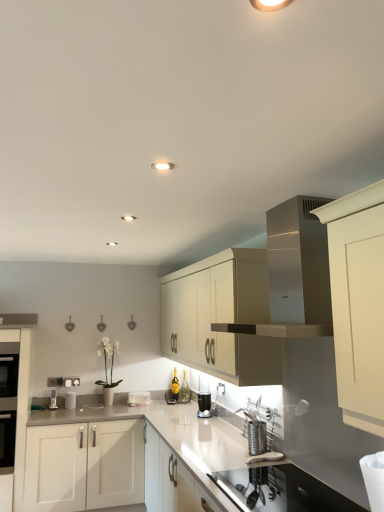
The width and height of the screenshot is (384, 512). In order to click on matte cream cabinet at center, the first cabinetry from the right in this screenshot , I will do `click(220, 317)`.

Locate an element on the screen. Image resolution: width=384 pixels, height=512 pixels. clear glass cup at center, the 3th appliance in the back-to-front sequence is located at coordinates tap(204, 399).

The image size is (384, 512). I want to click on black glass oven at left, so click(x=8, y=403).

Where is `white glossy toaster at center, which is the 2th appliance in left-to-right order`? The width and height of the screenshot is (384, 512). white glossy toaster at center, which is the 2th appliance in left-to-right order is located at coordinates (70, 400).

Is white glossy countertop at center outside of white glossy cabinet at left, arranged as the 1th cabinetry when viewed from the left?

Yes, white glossy countertop at center is located beyond the bounds of white glossy cabinet at left, arranged as the 1th cabinetry when viewed from the left.

Identify the location of countertop on the right side of white glossy cabinet at left, arranged as the 2th cabinetry when viewed from the right. (169, 432).

Is white glossy cabinet at left, arranged as the 1th cabinetry when viewed from the left, at the back of white glossy countertop at center?

No, white glossy countertop at center's orientation is not away from white glossy cabinet at left, arranged as the 1th cabinetry when viewed from the left.

From a real-world perspective, relative to satin silver vent at upper center, is black glass oven at left vertically above or below?

From a real-world perspective, black glass oven at left is physically below satin silver vent at upper center.

Is black glass oven at left oriented towards satin silver vent at upper center?

No, black glass oven at left does not turn towards satin silver vent at upper center.

From the image's perspective, would you say black glass oven at left is shown under satin silver vent at upper center?

Yes, from the image's perspective, black glass oven at left is below satin silver vent at upper center.

Is black glass oven at left placed right next to satin silver vent at upper center?

black glass oven at left and satin silver vent at upper center are not in contact.

Which object is positioned more to the right, white glossy cabinet at left, arranged as the 2th cabinetry when viewed from the right, or white glossy toaster at lower left, acting as the second appliance starting from the back?

white glossy toaster at lower left, acting as the second appliance starting from the back, is more to the right.

Does white glossy cabinet at left, arranged as the 1th cabinetry when viewed from the left, have a lesser height compared to white glossy toaster at lower left, which is the 3th appliance in right-to-left order?

Incorrect, the height of white glossy cabinet at left, arranged as the 1th cabinetry when viewed from the left, does not fall short of that of white glossy toaster at lower left, which is the 3th appliance in right-to-left order.

Locate an element on the screen. The width and height of the screenshot is (384, 512). the 2nd appliance above the white glossy cabinet at left, arranged as the 1th cabinetry when viewed from the left (from a real-world perspective) is located at coordinates (53, 400).

Based on the photo, is white glossy toaster at lower left, which is the 3th appliance in right-to-left order, located within white glossy cabinet at left, arranged as the 2th cabinetry when viewed from the right?

No, white glossy toaster at lower left, which is the 3th appliance in right-to-left order, is located outside of white glossy cabinet at left, arranged as the 2th cabinetry when viewed from the right.

From the image's perspective, is white glossy toaster at center, the 3th appliance viewed from the front, on top of white glossy countertop at center?

Yes, from the image's perspective, white glossy toaster at center, the 3th appliance viewed from the front, is above white glossy countertop at center.

Is white glossy toaster at center, the second appliance in the right-to-left sequence, wider or thinner than white glossy countertop at center?

Considering their sizes, white glossy toaster at center, the second appliance in the right-to-left sequence, looks slimmer than white glossy countertop at center.

Identify the location of countertop below the white glossy toaster at center, the second appliance in the right-to-left sequence (from the image's perspective). The height and width of the screenshot is (512, 384). (169, 432).

Considering the sizes of objects white glossy toaster at center, the second appliance in the right-to-left sequence, and white glossy countertop at center in the image provided, who is bigger, white glossy toaster at center, the second appliance in the right-to-left sequence, or white glossy countertop at center?

Bigger between the two is white glossy countertop at center.

How different are the orientations of clear glass cup at center, acting as the 3th appliance starting from the left, and satin silver vent at upper center in degrees?

They differ by 1.92 degrees in their facing directions.

Which is more to the left, clear glass cup at center, which is the first appliance in front-to-back order, or satin silver vent at upper center?

clear glass cup at center, which is the first appliance in front-to-back order, is more to the left.

Which of these two, clear glass cup at center, which is the first appliance in front-to-back order, or satin silver vent at upper center, stands taller?

With more height is satin silver vent at upper center.

Is clear glass cup at center, the 3th appliance in the back-to-front sequence, aimed at satin silver vent at upper center?

No.

In the image, is satin silver vent at upper center positioned in front of or behind matte cream cabinet at center, the first cabinetry from the right?

satin silver vent at upper center is positioned closer to the viewer than matte cream cabinet at center, the first cabinetry from the right.

Between satin silver vent at upper center and matte cream cabinet at center, the first cabinetry from the right, which one has smaller width?

Thinner between the two is matte cream cabinet at center, the first cabinetry from the right.

From the image's perspective, between satin silver vent at upper center and matte cream cabinet at center, the second cabinetry from the left, which one is located above?

satin silver vent at upper center is shown above in the image.

Is clear glass cup at center, which is the first appliance in front-to-back order, in front of or behind white glossy toaster at lower left, acting as the second appliance starting from the back, in the image?

Visually, clear glass cup at center, which is the first appliance in front-to-back order, is located in front of white glossy toaster at lower left, acting as the second appliance starting from the back.

In terms of size, does clear glass cup at center, acting as the 3th appliance starting from the left, appear bigger or smaller than white glossy toaster at lower left, the 1th appliance positioned from the left?

clear glass cup at center, acting as the 3th appliance starting from the left, is bigger than white glossy toaster at lower left, the 1th appliance positioned from the left.

Is clear glass cup at center, acting as the 3th appliance starting from the left, with white glossy toaster at lower left, acting as the second appliance starting from the back?

clear glass cup at center, acting as the 3th appliance starting from the left, and white glossy toaster at lower left, acting as the second appliance starting from the back, are not in contact.

You are a GUI agent. You are given a task and a screenshot of the screen. Output one action in this format:
    pyautogui.click(x=<x>, y=<y>)
    Task: Click on the appliance in front of the white glossy toaster at lower left, positioned as the 2th appliance in front-to-back order
    This screenshot has height=512, width=384.
    Given the screenshot: What is the action you would take?
    pyautogui.click(x=204, y=399)

This screenshot has width=384, height=512. In order to click on the 1st cabinetry above when counting from the white glossy countertop at center (from the image's perspective) in this screenshot , I will do `click(20, 408)`.

You are a GUI agent. You are given a task and a screenshot of the screen. Output one action in this format:
    pyautogui.click(x=<x>, y=<y>)
    Task: Click on the oven that appears behind the satin silver vent at upper center
    The height and width of the screenshot is (512, 384).
    Given the screenshot: What is the action you would take?
    pyautogui.click(x=8, y=403)

When comparing their distances from matte cream cabinet at center, the first cabinetry from the right, does white glossy countertop at center or white glossy toaster at lower left, which is the 3th appliance in right-to-left order, seem closer?

white glossy countertop at center is closer to matte cream cabinet at center, the first cabinetry from the right.

Which object lies nearer to the anchor point matte cream cabinet at center, the first cabinetry from the right, clear glass cup at center, the 3th appliance in the back-to-front sequence, or black glass oven at left?

Based on the image, clear glass cup at center, the 3th appliance in the back-to-front sequence, appears to be nearer to matte cream cabinet at center, the first cabinetry from the right.

Based on their spatial positions, is white glossy toaster at center, the 3th appliance viewed from the front, or black glass oven at left further from white glossy cabinet at left, arranged as the 2th cabinetry when viewed from the right?

The object further to white glossy cabinet at left, arranged as the 2th cabinetry when viewed from the right, is white glossy toaster at center, the 3th appliance viewed from the front.

Estimate the real-world distances between objects in this image. Which object is closer to clear glass cup at center, the 3th appliance in the back-to-front sequence, matte cream cabinet at center, the first cabinetry from the right, or black glass oven at left?

The object closer to clear glass cup at center, the 3th appliance in the back-to-front sequence, is matte cream cabinet at center, the first cabinetry from the right.

When comparing their distances from matte cream cabinet at center, the first cabinetry from the right, does white glossy toaster at lower left, acting as the second appliance starting from the back, or satin silver vent at upper center seem closer?

satin silver vent at upper center lies closer to matte cream cabinet at center, the first cabinetry from the right, than the other object.

Looking at the image, which one is located closer to white glossy cabinet at left, arranged as the 2th cabinetry when viewed from the right, satin silver vent at upper center or white glossy toaster at lower left, acting as the second appliance starting from the back?

The object closer to white glossy cabinet at left, arranged as the 2th cabinetry when viewed from the right, is white glossy toaster at lower left, acting as the second appliance starting from the back.

Which object lies nearer to the anchor point black glass oven at left, white glossy toaster at center, the second appliance in the right-to-left sequence, or clear glass cup at center, acting as the 3th appliance starting from the left?

white glossy toaster at center, the second appliance in the right-to-left sequence.

When comparing their distances from clear glass cup at center, the 3th appliance in the back-to-front sequence, does black glass oven at left or satin silver vent at upper center seem closer?

black glass oven at left.

Where is `vent positioned between white glossy countertop at center and white glossy toaster at center, the second appliance in the right-to-left sequence, from near to far`? vent positioned between white glossy countertop at center and white glossy toaster at center, the second appliance in the right-to-left sequence, from near to far is located at coordinates (297, 271).

The width and height of the screenshot is (384, 512). I want to click on oven between satin silver vent at upper center and white glossy toaster at lower left, the 1th appliance positioned from the left, from front to back, so 8,403.

Locate an element on the screen. The height and width of the screenshot is (512, 384). vent between white glossy countertop at center and white glossy cabinet at left, arranged as the 1th cabinetry when viewed from the left, in the front-back direction is located at coordinates (297, 271).

The image size is (384, 512). Find the location of `vent located between white glossy countertop at center and clear glass cup at center, acting as the 3th appliance starting from the left, in the depth direction`. vent located between white glossy countertop at center and clear glass cup at center, acting as the 3th appliance starting from the left, in the depth direction is located at coordinates (297, 271).